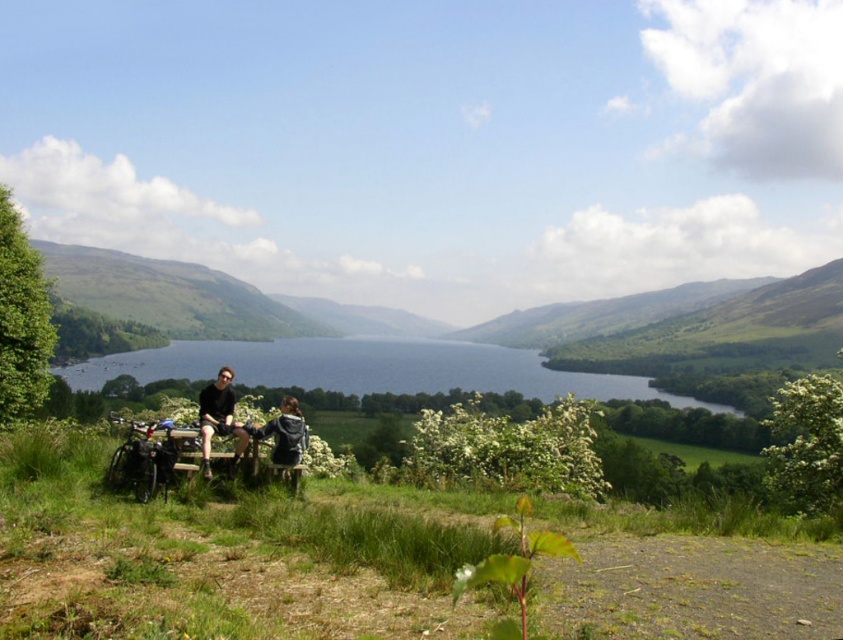
Question: Estimate the real-world distances between objects in this image. Which object is closer to the blue water at center?

Choices:
 (A) black fabric jacket at lower left
 (B) dark blue jeans at center

Answer: (B)

Question: Can you confirm if dark blue jeans at center is wider than dark gray jacket at lower center?

Choices:
 (A) no
 (B) yes

Answer: (B)

Question: Is blue water at center wider than dark blue jeans at center?

Choices:
 (A) no
 (B) yes

Answer: (B)

Question: Considering the relative positions of blue water at center and black fabric jacket at lower left in the image provided, where is blue water at center located with respect to black fabric jacket at lower left?

Choices:
 (A) left
 (B) right

Answer: (A)

Question: Which point is closer to the camera taking this photo?

Choices:
 (A) (227, 420)
 (B) (207, 417)

Answer: (B)

Question: Among these points, which one is farthest from the camera?

Choices:
 (A) (277, 461)
 (B) (344, 381)

Answer: (B)